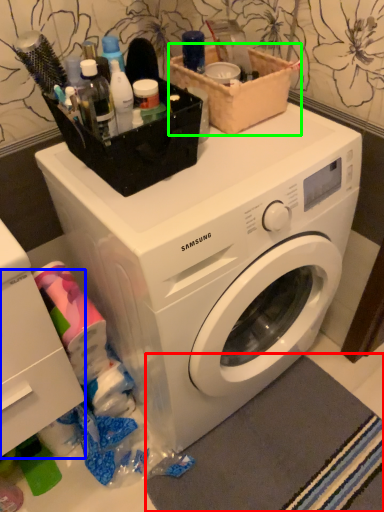
Question: Considering the real-world distances, which object is closest to bath mat (highlighted by a red box)? drawer (highlighted by a blue box) or basket (highlighted by a green box).

Choices:
 (A) drawer
 (B) basket

Answer: (A)